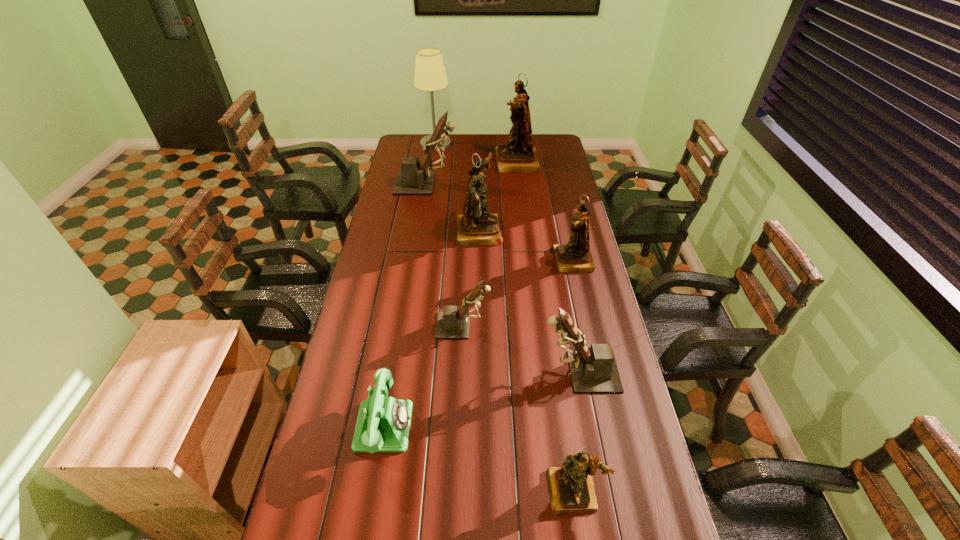
Identify the location of the fifth farthest figurine. (453, 323).

The height and width of the screenshot is (540, 960). In order to click on the smallest brown figurine in this screenshot , I will do `click(453, 323)`.

This screenshot has width=960, height=540. I want to click on the smallest gold figurine, so click(x=571, y=487).

You are a GUI agent. You are given a task and a screenshot of the screen. Output one action in this format:
    pyautogui.click(x=<x>, y=<y>)
    Task: Click on the nearest figurine
    The image size is (960, 540).
    Given the screenshot: What is the action you would take?
    pyautogui.click(x=571, y=487)

What are the coordinates of `the shortest object` in the screenshot? It's located at (383, 424).

Where is `green telephone`? The width and height of the screenshot is (960, 540). green telephone is located at coordinates (383, 424).

Find the location of `vacant space located 0.290m on the right of the table lamp`. vacant space located 0.290m on the right of the table lamp is located at coordinates (503, 144).

This screenshot has height=540, width=960. Identify the location of vacant area situated 0.180m on the front-facing side of the tallest figurine. (459, 163).

You are a GUI agent. You are given a task and a screenshot of the screen. Output one action in this format:
    pyautogui.click(x=<x>, y=<y>)
    Task: Click on the free space located 0.130m on the front-facing side of the tallest figurine
    The width and height of the screenshot is (960, 540).
    Given the screenshot: What is the action you would take?
    pyautogui.click(x=468, y=163)

This screenshot has width=960, height=540. Find the location of `vacant region located on the front-facing side of the tallest figurine`. vacant region located on the front-facing side of the tallest figurine is located at coordinates (425, 163).